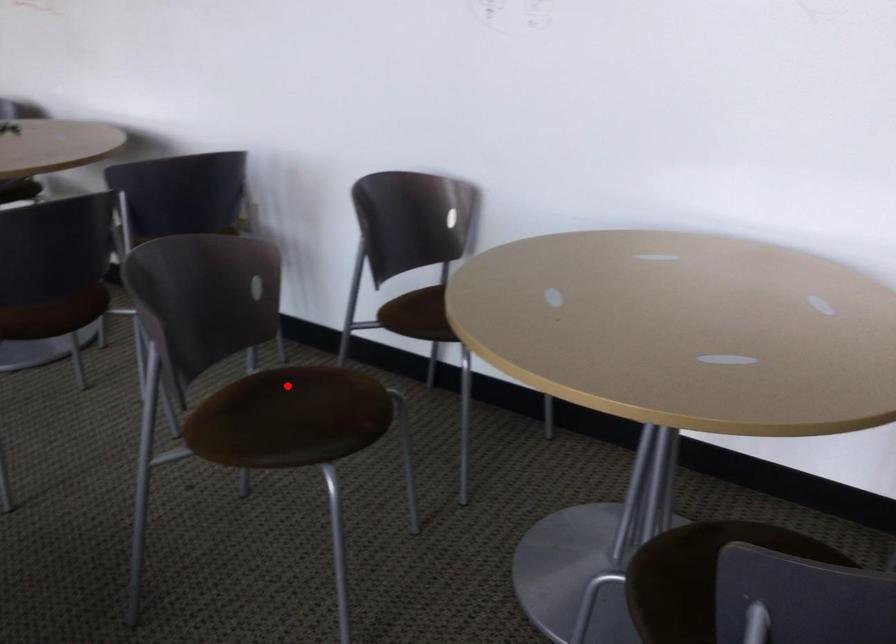
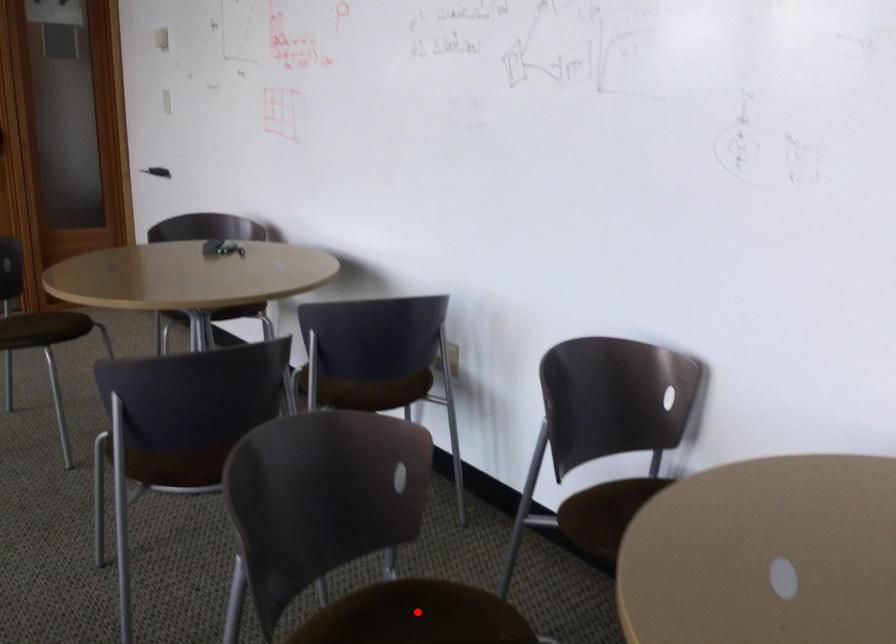
I am providing you with two images of the same scene from different viewpoints. A red point is marked on the first image and another point is marked on the second image. Is the marked point in image1 the same physical position as the marked point in image2?

Yes